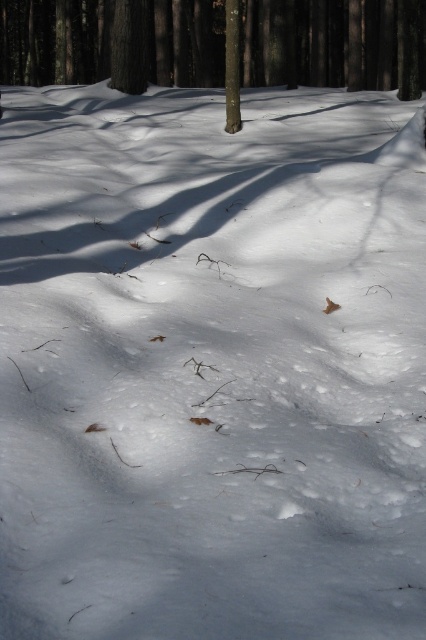
Question: Can you confirm if brown rough tree at center is thinner than smooth brown tree trunk at center?

Choices:
 (A) yes
 (B) no

Answer: (B)

Question: Does brown rough tree at center have a larger size compared to smooth brown tree trunk at center?

Choices:
 (A) yes
 (B) no

Answer: (A)

Question: In this image, where is brown rough tree at center located relative to smooth brown tree trunk at center?

Choices:
 (A) left
 (B) right

Answer: (B)

Question: Among these objects, which one is farthest from the camera?

Choices:
 (A) smooth brown tree trunk at center
 (B) brown rough tree at center

Answer: (B)